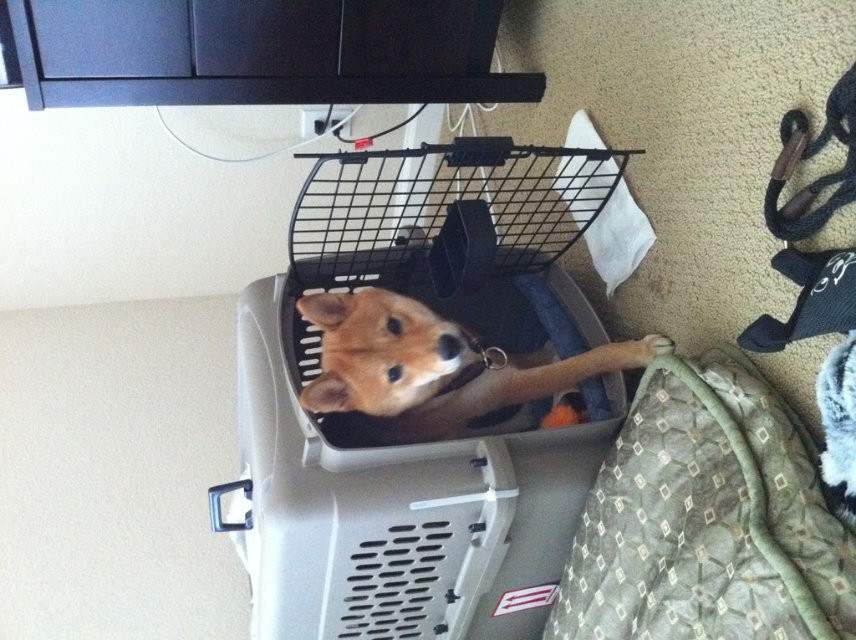
You are a dog owner who wants to place your golden fur dog at center onto the green quilted dog bed at lower right. Based on the scene description, will the bed be able to support the dog?

The green quilted dog bed at lower right is thinner than the golden fur dog at center, so it may not provide sufficient support for the dog.

You are a pet sitter who needs to place a 10 inch long toy next to the green quilted dog bed at lower right and the golden fur dog at center. Is there enough space between them to fit the toy?

The green quilted dog bed at lower right is 9.15 inches away from the golden fur dog at center. Since the toy is 10 inches long, there isn not enough space to fit it between them.

You are a dog owner who wants to move your dog from the carrier to the green quilted dog bed at lower right. The dog is 30 centimeters tall. Can the dog reach the bed without assistance?

The distance between the green quilted dog bed at lower right and the viewer is 72.63 centimeters. Since the dog is 30 centimeters tall, it cannot jump that distance without help. You should assist the dog to reach the bed safely.